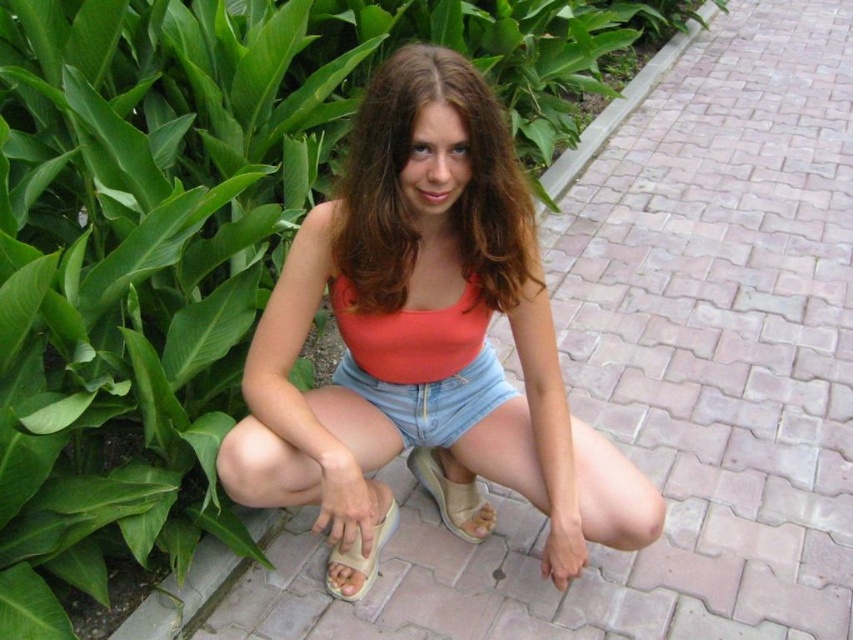
You are a photographer setting up a shoot in a garden. You have a matte coral bikini top at center and denim shorts at center. Which clothing item should you focus on first if you want to capture the larger item in your frame?

The denim shorts at center is larger than the matte coral bikini top at center, so you should focus on the denim shorts at center first to capture the larger item in your frame.